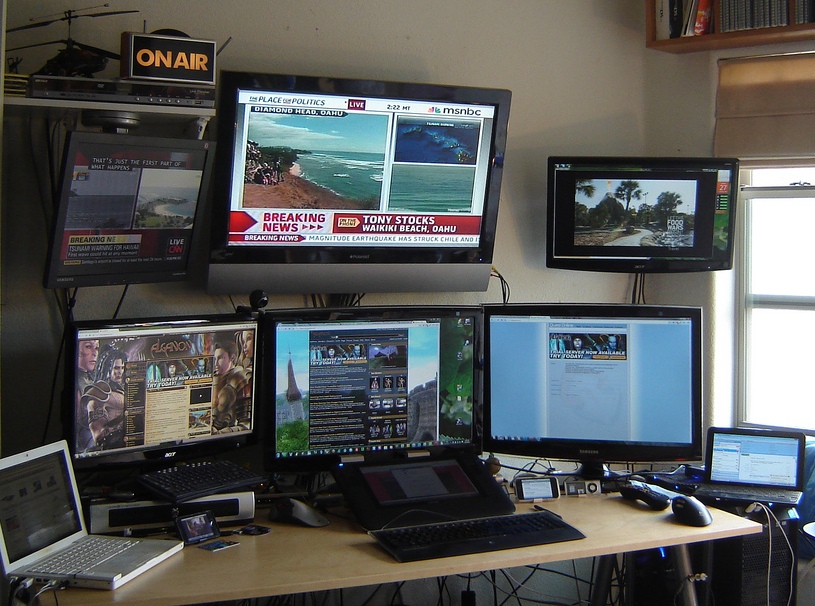
The height and width of the screenshot is (606, 815). Find the location of `computer monitor`. computer monitor is located at coordinates click(x=161, y=395), click(x=55, y=505), click(x=397, y=368), click(x=605, y=376), click(x=755, y=467).